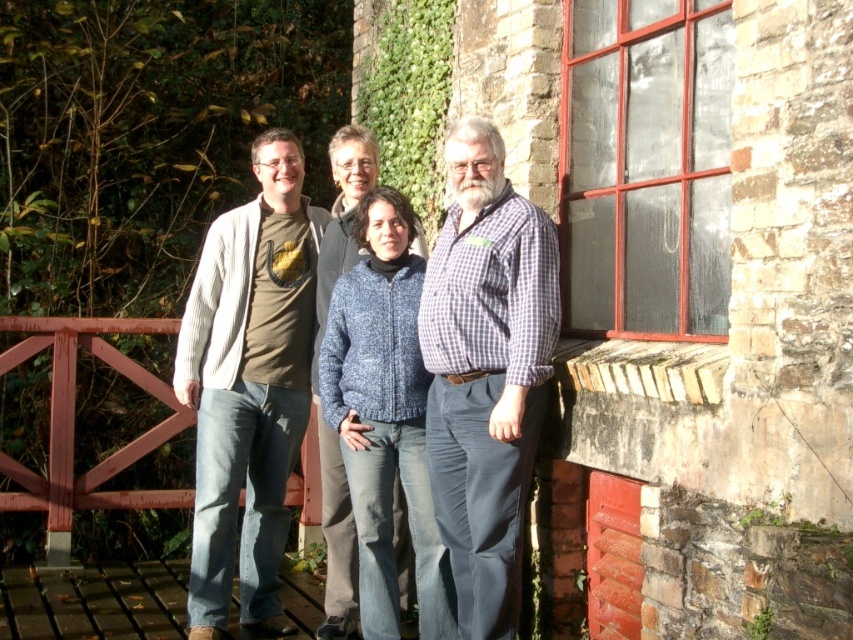
Is checkered fabric shirt at center to the left of knitted blue sweater at center from the viewer's perspective?

In fact, checkered fabric shirt at center is to the right of knitted blue sweater at center.

Who is more forward, (453,252) or (364,161)?

Point (453,252)

Image resolution: width=853 pixels, height=640 pixels. What are the coordinates of `checkered fabric shirt at center` in the screenshot? It's located at (486, 372).

Can you confirm if checkered fabric shirt at center is smaller than knitted sweater at center?

Correct, checkered fabric shirt at center occupies less space than knitted sweater at center.

Is point (454, 467) closer to viewer compared to point (260, 534)?

That is True.

Is point (503, 616) farther from camera compared to point (235, 333)?

That is False.

Identify the location of checkered fabric shirt at center. This screenshot has height=640, width=853. (486, 372).

Describe the element at coordinates (486, 372) in the screenshot. I see `checkered fabric shirt at center` at that location.

Does checkered fabric shirt at center lie in front of matte gray cardigan at left?

Yes, checkered fabric shirt at center is closer to the viewer.

You are a GUI agent. You are given a task and a screenshot of the screen. Output one action in this format:
    pyautogui.click(x=<x>, y=<y>)
    Task: Click on the checkered fabric shirt at center
    The height and width of the screenshot is (640, 853).
    Given the screenshot: What is the action you would take?
    pyautogui.click(x=486, y=372)